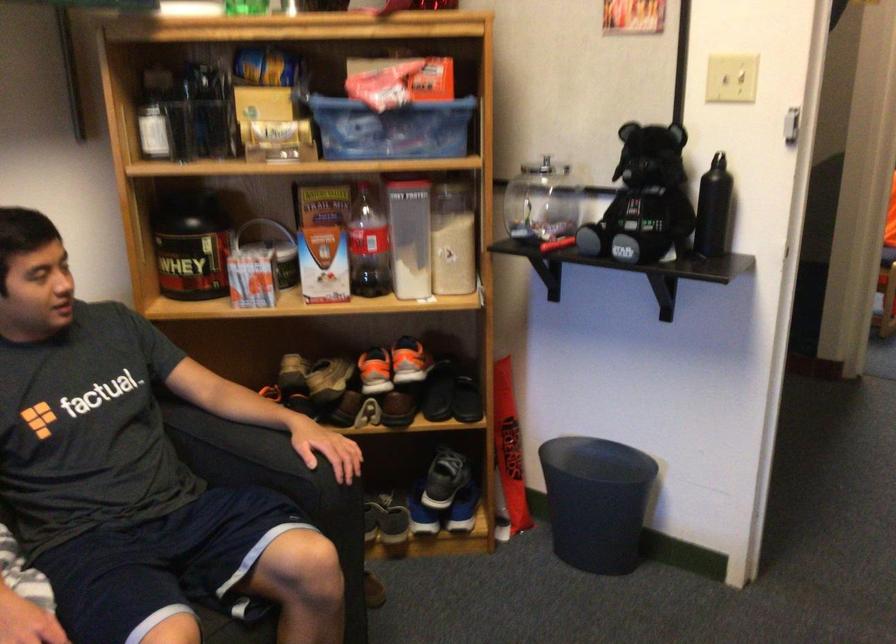
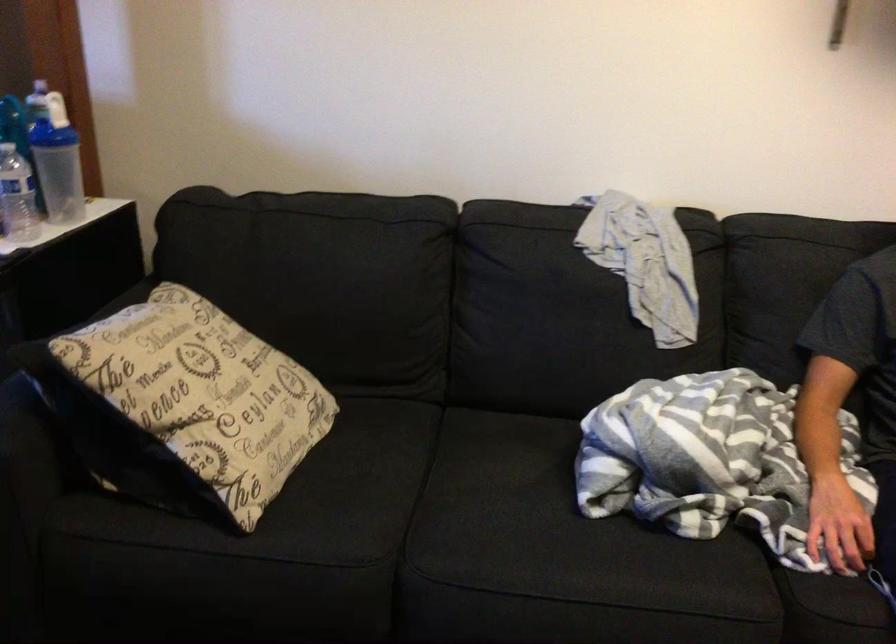
Question: The camera is either moving clockwise (left) or counter-clockwise (right) around the object. The first image is from the beginning of the video and the second image is from the end. Is the camera moving left or right when shooting the video?

Choices:
 (A) Left
 (B) Right

Answer: (B)